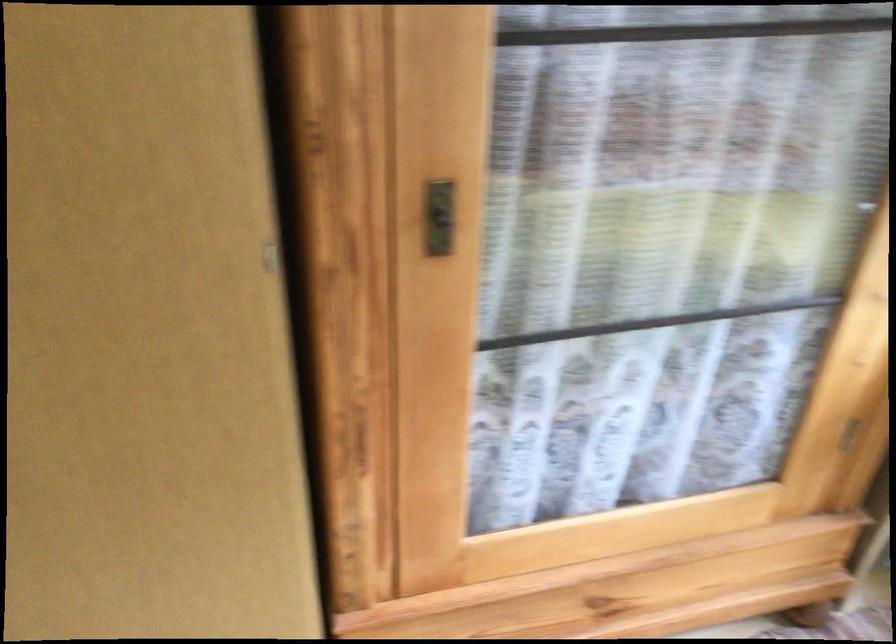
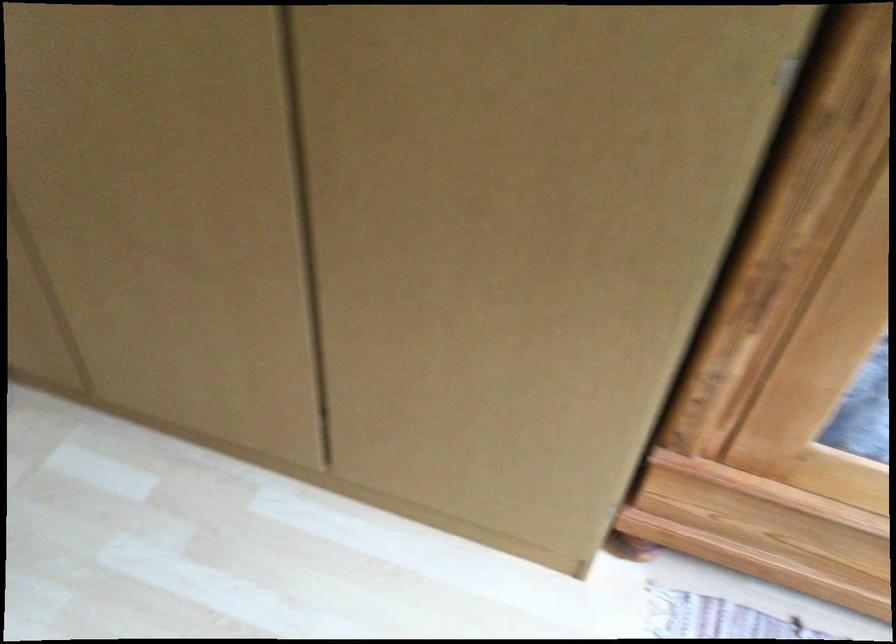
Question: The camera is either moving clockwise (left) or counter-clockwise (right) around the object. The first image is from the beginning of the video and the second image is from the end. Is the camera moving left or right when shooting the video?

Choices:
 (A) Left
 (B) Right

Answer: (B)